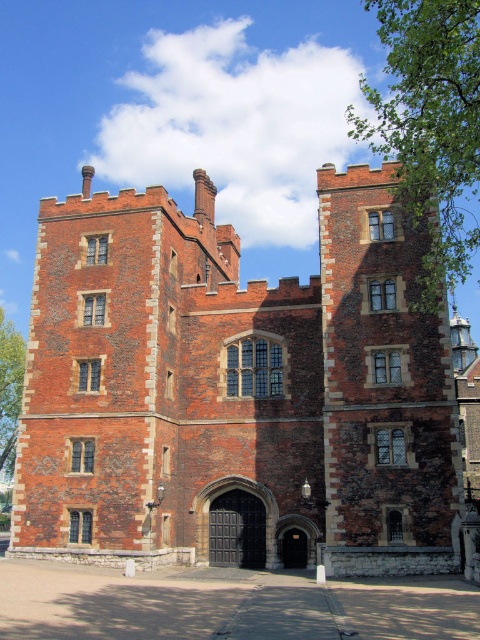
Question: Considering the relative positions of brick stone castle at center and dark brown wooden gate at center in the image provided, where is brick stone castle at center located with respect to dark brown wooden gate at center?

Choices:
 (A) above
 (B) below

Answer: (A)

Question: Which of the following is the farthest from the observer?

Choices:
 (A) (71, 474)
 (B) (292, 544)
 (C) (213, 516)

Answer: (C)

Question: Which of the following is the farthest from the observer?

Choices:
 (A) (239, 529)
 (B) (286, 563)

Answer: (A)

Question: Which point is closer to the camera?

Choices:
 (A) (396, 522)
 (B) (304, 536)
 (C) (231, 518)

Answer: (A)

Question: Can you confirm if brick stone castle at center is positioned below dark brown wooden gate at center?

Choices:
 (A) yes
 (B) no

Answer: (B)

Question: Is dark brown wooden gate at center wider than smooth stone archway at center?

Choices:
 (A) no
 (B) yes

Answer: (A)